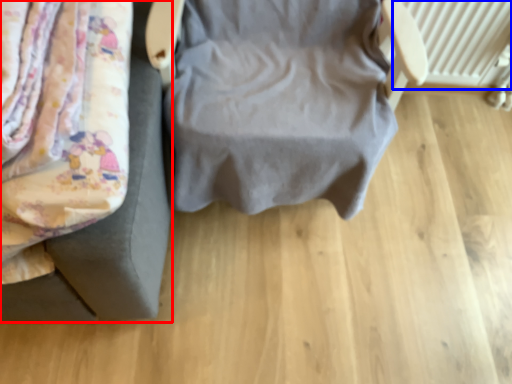
Question: Which object is further to the camera taking this photo, furniture (highlighted by a red box) or radiator (highlighted by a blue box)?

Choices:
 (A) furniture
 (B) radiator

Answer: (B)